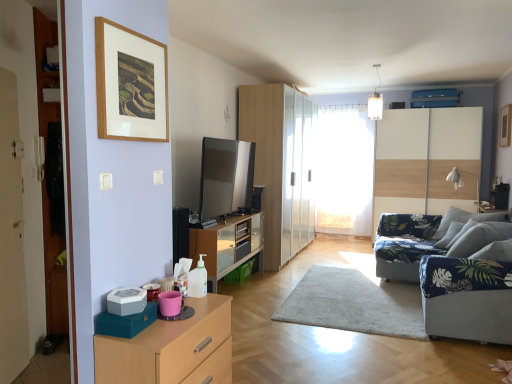
What is the approximate height of transparent glass wardrobe at center?

It is 2.39 meters.

In order to face transparent glass wardrobe at center, should I rotate leftwards or rightwards?

To align with it, rotate right about 6.507°.

This screenshot has height=384, width=512. In order to click on wooden picture frame at upper left, which is the second picture frame from back to front in this screenshot , I will do `click(130, 84)`.

Consider the image. Which object is thinner, gray plastic pet food container at lower left, placed as the first appliance when sorted from bottom to top, or wooden picture frame at upper left, which is the second picture frame from back to front?

wooden picture frame at upper left, which is the second picture frame from back to front.

Does gray plastic pet food container at lower left, placed as the first appliance when sorted from bottom to top, come in front of wooden picture frame at upper left, which is the second picture frame from back to front?

No, the depth of gray plastic pet food container at lower left, placed as the first appliance when sorted from bottom to top, is greater than that of wooden picture frame at upper left, which is the second picture frame from back to front.

How different are the orientations of gray plastic pet food container at lower left, the 2th appliance from the back, and wooden picture frame at upper left, acting as the 1th picture frame starting from the left, in degrees?

0.026 degrees.

Is gray plastic pet food container at lower left, the 2th appliance from the back, facing away from wooden picture frame at upper left, which is the 2th picture frame in right-to-left order?

gray plastic pet food container at lower left, the 2th appliance from the back, does not have its back to wooden picture frame at upper left, which is the 2th picture frame in right-to-left order.

What's the angular difference between blue fabric couch at right and satin silver tv at center, which is the first appliance from right to left,'s facing directions?

The facing directions of blue fabric couch at right and satin silver tv at center, which is the first appliance from right to left, are 91.5 degrees apart.

Can you confirm if blue fabric couch at right is positioned to the left of satin silver tv at center, the 1th appliance in the top-to-bottom sequence?

Incorrect, blue fabric couch at right is not on the left side of satin silver tv at center, the 1th appliance in the top-to-bottom sequence.

Do you think blue fabric couch at right is within satin silver tv at center, the 2th appliance positioned from the left, or outside of it?

blue fabric couch at right cannot be found inside satin silver tv at center, the 2th appliance positioned from the left.

Is blue fabric couch at right facing towards satin silver tv at center, the 1th appliance in the top-to-bottom sequence?

No, blue fabric couch at right does not turn towards satin silver tv at center, the 1th appliance in the top-to-bottom sequence.

From a real-world perspective, is blue fabric couch at right over blue fabric armchair at right?

No.

Based on the photo, can you confirm if blue fabric couch at right is positioned to the left of blue fabric armchair at right?

No, blue fabric couch at right is not to the left of blue fabric armchair at right.

Can we say blue fabric couch at right lies outside blue fabric armchair at right?

Indeed, blue fabric couch at right is completely outside blue fabric armchair at right.

What's the angular difference between blue fabric couch at right and white sheer curtain at center's facing directions?

blue fabric couch at right and white sheer curtain at center are facing 3.43 degrees away from each other.

Which point is more distant from viewer, (473, 245) or (337, 192)?

Point (337, 192)

Does blue fabric couch at right have a greater width compared to white sheer curtain at center?

Indeed, blue fabric couch at right has a greater width compared to white sheer curtain at center.

From a real-world perspective, is light wood/wooden chest of drawers at lower left located higher than glossy wood cupboard at center?

Actually, light wood/wooden chest of drawers at lower left is physically below glossy wood cupboard at center in the real world.

Is light wood/wooden chest of drawers at lower left looking in the opposite direction of glossy wood cupboard at center?

That's not correct — light wood/wooden chest of drawers at lower left is not looking away from glossy wood cupboard at center.

In terms of width, does light wood/wooden chest of drawers at lower left look wider or thinner when compared to glossy wood cupboard at center?

Clearly, light wood/wooden chest of drawers at lower left has less width compared to glossy wood cupboard at center.

Based on the photo, is light wood/wooden chest of drawers at lower left positioned beyond the bounds of glossy wood cupboard at center?

Yes, light wood/wooden chest of drawers at lower left is located beyond the bounds of glossy wood cupboard at center.

Can you confirm if light wood/wooden chest of drawers at lower left is thinner than blue fabric armchair at right?

Correct, the width of light wood/wooden chest of drawers at lower left is less than that of blue fabric armchair at right.

How far apart are light wood/wooden chest of drawers at lower left and blue fabric armchair at right?

light wood/wooden chest of drawers at lower left and blue fabric armchair at right are 6.76 feet apart.

I want to click on armchair that is on the right side of light wood/wooden chest of drawers at lower left, so click(470, 316).

Is there a large distance between light wood/wooden chest of drawers at lower left and blue fabric armchair at right?

Indeed, light wood/wooden chest of drawers at lower left is not near blue fabric armchair at right.

Is gray plastic pet food container at lower left, the second appliance positioned from the top, in front of or behind satin silver tv at center, positioned as the second appliance in front-to-back order, in the image?

gray plastic pet food container at lower left, the second appliance positioned from the top, is positioned closer to the viewer than satin silver tv at center, positioned as the second appliance in front-to-back order.

Does gray plastic pet food container at lower left, which is the 1th appliance in front-to-back order, turn towards satin silver tv at center, the 2th appliance positioned from the left?

No.

How many degrees apart are the facing directions of gray plastic pet food container at lower left, the 2th appliance from the back, and satin silver tv at center, positioned as the 1th appliance in back-to-front order?

They differ by 0.192 degrees in their facing directions.

From a real-world perspective, is gray plastic pet food container at lower left, the 1th appliance in the left-to-right sequence, physically above satin silver tv at center, the 1th appliance in the top-to-bottom sequence?

No, from a real-world perspective, gray plastic pet food container at lower left, the 1th appliance in the left-to-right sequence, is not on top of satin silver tv at center, the 1th appliance in the top-to-bottom sequence.

Identify the location of picture frame that appears on the left of gray plastic pet food container at lower left, which is the 1th appliance in front-to-back order. (130, 84).

Identify the location of studio couch below the satin silver tv at center, the 2th appliance positioned from the left (from a real-world perspective). (434, 242).

Based on their spatial positions, is white sheer curtain at center or wooden picture frame at upper left, arranged as the first picture frame when viewed from the front, closer to blue fabric couch at right?

The object closer to blue fabric couch at right is white sheer curtain at center.

Estimate the real-world distances between objects in this image. Which object is further from blue fabric couch at right, matte wood dresser at center, placed as the second dresser when sorted from back to front, or white glossy dresser at right, marked as the 2th dresser in a front-to-back arrangement?

matte wood dresser at center, placed as the second dresser when sorted from back to front.

Estimate the real-world distances between objects in this image. Which object is closer to white glossy dresser at right, which is the first dresser in right-to-left order, satin silver tv at center, which is the first appliance from right to left, or blue fabric couch at right?

Among the two, blue fabric couch at right is located nearer to white glossy dresser at right, which is the first dresser in right-to-left order.

Looking at the image, which one is located further to light wood/wooden chest of drawers at lower left, blue fabric couch at right or glossy wood cupboard at center?

Based on the image, glossy wood cupboard at center appears to be further to light wood/wooden chest of drawers at lower left.

From the image, which object appears to be nearer to transparent glass wardrobe at center, glossy wood cupboard at center or wooden picture frame at upper left, acting as the 1th picture frame starting from the left?

glossy wood cupboard at center is positioned closer to the anchor transparent glass wardrobe at center.

Estimate the real-world distances between objects in this image. Which object is closer to wooden picture frame at upper right, placed as the 2th picture frame when sorted from front to back, blue fabric couch at right or transparent glass wardrobe at center?

blue fabric couch at right.

From the image, which object appears to be nearer to blue fabric couch at right, glossy wood cupboard at center or white sheer curtain at center?

Among the two, white sheer curtain at center is located nearer to blue fabric couch at right.

Which object lies further to the anchor point gray plastic pet food container at lower left, the 2th appliance from the back, matte wood dresser at center, placed as the second dresser when sorted from back to front, or wooden picture frame at upper left, arranged as the first picture frame when viewed from the front?

matte wood dresser at center, placed as the second dresser when sorted from back to front, is further to gray plastic pet food container at lower left, the 2th appliance from the back.

The width and height of the screenshot is (512, 384). I want to click on appliance located between blue fabric armchair at right and white glossy dresser at right, the 1th dresser viewed from the back, in the depth direction, so click(x=225, y=176).

The width and height of the screenshot is (512, 384). What are the coordinates of `the chest of drawers situated between wooden picture frame at upper left, which is the 2th picture frame in right-to-left order, and blue fabric couch at right from left to right` in the screenshot? It's located at (172, 349).

Where is `studio couch between wooden picture frame at upper left, which is the 2th picture frame in right-to-left order, and glossy wood cupboard at center, along the z-axis`? studio couch between wooden picture frame at upper left, which is the 2th picture frame in right-to-left order, and glossy wood cupboard at center, along the z-axis is located at coordinates (434, 242).

This screenshot has height=384, width=512. Find the location of `dresser positioned between light wood/wooden chest of drawers at lower left and glossy wood cupboard at center from near to far`. dresser positioned between light wood/wooden chest of drawers at lower left and glossy wood cupboard at center from near to far is located at coordinates (228, 245).